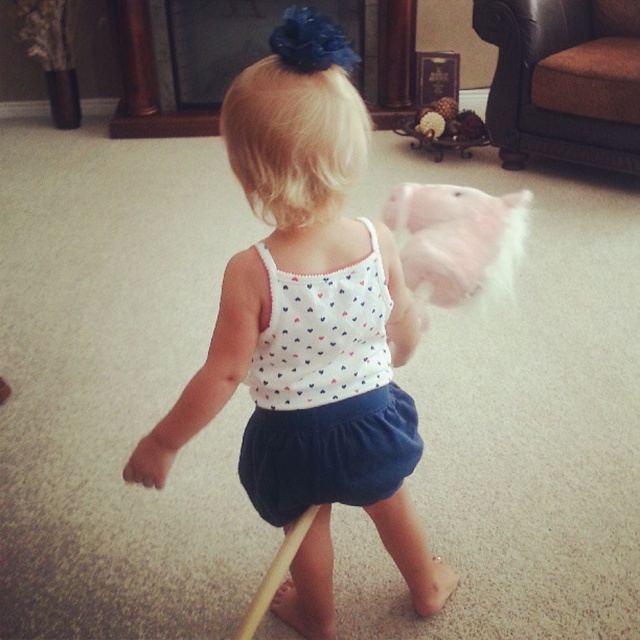
Question: Which object appears closest to the camera in this image?

Choices:
 (A) blue denim ballet skirt at center
 (B) fuzzy cotton candy at center

Answer: (A)

Question: Does white dotted tank top at center have a lesser width compared to blue denim ballet skirt at center?

Choices:
 (A) no
 (B) yes

Answer: (A)

Question: Can you confirm if white dotted fabric dress at center is smaller than fuzzy cotton candy at center?

Choices:
 (A) no
 (B) yes

Answer: (B)

Question: Which point is farther to the camera?

Choices:
 (A) blue denim ballet skirt at center
 (B) fuzzy cotton candy at center
 (C) white dotted tank top at center

Answer: (B)

Question: Does white dotted fabric dress at center have a lesser width compared to blue denim ballet skirt at center?

Choices:
 (A) no
 (B) yes

Answer: (B)

Question: Considering the real-world distances, which object is closest to the blonde hair at center?

Choices:
 (A) fuzzy cotton candy at center
 (B) blue denim ballet skirt at center

Answer: (B)